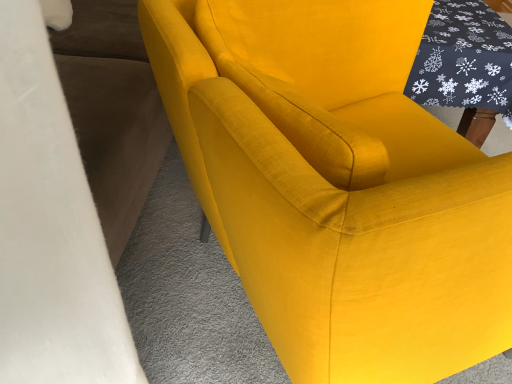
Question: Considering the relative sizes of dark gray fabric table at upper right and matte yellow fabric chair at center in the image provided, is dark gray fabric table at upper right taller than matte yellow fabric chair at center?

Choices:
 (A) no
 (B) yes

Answer: (A)

Question: Can you confirm if dark gray fabric table at upper right is bigger than matte yellow fabric chair at center?

Choices:
 (A) no
 (B) yes

Answer: (A)

Question: Is dark gray fabric table at upper right next to matte yellow fabric chair at center and touching it?

Choices:
 (A) no
 (B) yes

Answer: (A)

Question: Is dark gray fabric table at upper right aimed at matte yellow fabric chair at center?

Choices:
 (A) yes
 (B) no

Answer: (B)

Question: Is dark gray fabric table at upper right at the right side of matte yellow fabric chair at center?

Choices:
 (A) no
 (B) yes

Answer: (B)

Question: Is dark gray fabric table at upper right to the left of matte yellow fabric chair at center from the viewer's perspective?

Choices:
 (A) no
 (B) yes

Answer: (A)

Question: Is matte yellow fabric chair at center positioned behind dark gray fabric table at upper right?

Choices:
 (A) no
 (B) yes

Answer: (A)

Question: Considering the relative sizes of matte yellow fabric chair at center and dark gray fabric table at upper right in the image provided, is matte yellow fabric chair at center shorter than dark gray fabric table at upper right?

Choices:
 (A) no
 (B) yes

Answer: (A)

Question: From the image's perspective, is matte yellow fabric chair at center over dark gray fabric table at upper right?

Choices:
 (A) yes
 (B) no

Answer: (B)

Question: Can you confirm if matte yellow fabric chair at center is positioned to the left of dark gray fabric table at upper right?

Choices:
 (A) no
 (B) yes

Answer: (B)

Question: Does matte yellow fabric chair at center have a lesser width compared to dark gray fabric table at upper right?

Choices:
 (A) yes
 (B) no

Answer: (B)

Question: Is dark gray fabric table at upper right inside matte yellow fabric chair at center?

Choices:
 (A) yes
 (B) no

Answer: (B)

Question: From the image's perspective, is dark gray fabric table at upper right above or below matte yellow fabric chair at center?

Choices:
 (A) below
 (B) above

Answer: (B)